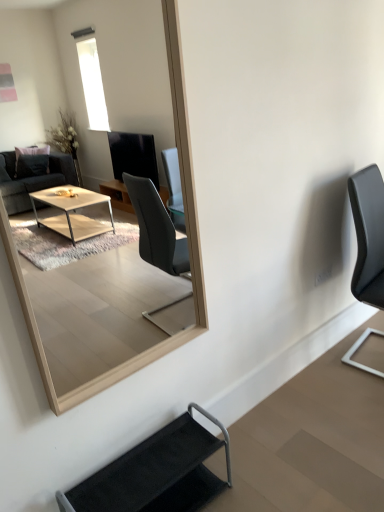
The height and width of the screenshot is (512, 384). In order to click on vacant area that is situated to the right of black fabric chair at lower center, acting as the 1th chair starting from the left in this screenshot , I will do `click(262, 472)`.